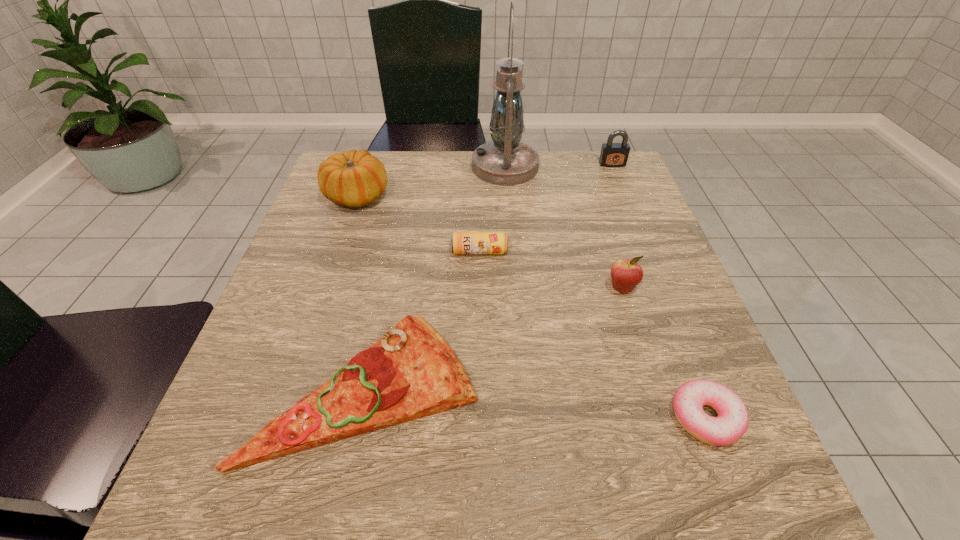
Image resolution: width=960 pixels, height=540 pixels. Identify the location of vacant space located 0.070m on the right of the fifth farthest object. (672, 288).

The height and width of the screenshot is (540, 960). In order to click on vacant area situated 0.070m on the left of the fourth farthest object in this screenshot , I will do `click(420, 252)`.

At what (x,y) coordinates should I click in order to perform the action: click on free space located 0.290m on the right of the pizza. Please return your answer as a coordinate pair (x, y). The width and height of the screenshot is (960, 540). Looking at the image, I should click on (656, 388).

Where is `free space located 0.370m on the left of the doughnut`? The image size is (960, 540). free space located 0.370m on the left of the doughnut is located at coordinates (433, 417).

The width and height of the screenshot is (960, 540). Identify the location of oil lamp that is positioned at the far edge. (505, 161).

Where is `gourd present at the far edge`? The width and height of the screenshot is (960, 540). gourd present at the far edge is located at coordinates (354, 178).

Image resolution: width=960 pixels, height=540 pixels. What are the coordinates of `padlock that is at the far edge` in the screenshot? It's located at (612, 154).

The image size is (960, 540). What are the coordinates of `object positioned at the near edge` in the screenshot? It's located at point(411,372).

What are the coordinates of `gourd present at the left edge` in the screenshot? It's located at (354, 178).

Find the location of a particular element. This screenshot has height=540, width=960. pizza that is at the left edge is located at coordinates (411, 372).